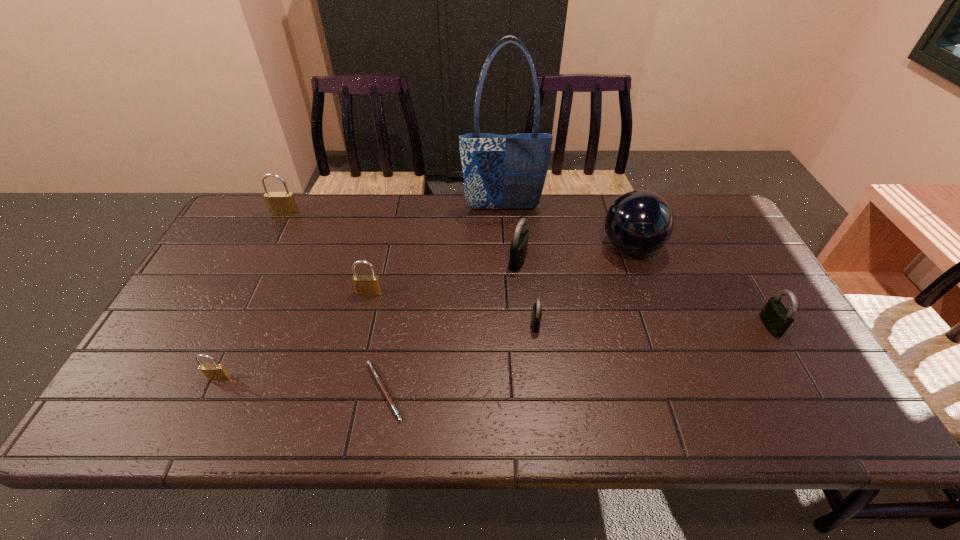
This screenshot has height=540, width=960. What are the coordinates of `the second biggest brass padlock` in the screenshot? It's located at [x=364, y=284].

Where is `the smallest black padlock`? the smallest black padlock is located at coordinates (536, 312).

I want to click on the nearest padlock, so click(212, 371).

At what (x,y) coordinates should I click in order to perform the action: click on the nearest brass padlock. Please return your answer as a coordinate pair (x, y). The height and width of the screenshot is (540, 960). Looking at the image, I should click on (212, 371).

Identify the location of pen. This screenshot has width=960, height=540. (372, 368).

Locate an element on the screen. The image size is (960, 540). pink pen is located at coordinates (372, 368).

Image resolution: width=960 pixels, height=540 pixels. Find the location of `vacant space located 0.220m on the front-facing side of the shopping bag`. vacant space located 0.220m on the front-facing side of the shopping bag is located at coordinates (506, 260).

Image resolution: width=960 pixels, height=540 pixels. In order to click on vacant space located 0.340m on the side of the black bowling ball with the finger holes in this screenshot , I will do `click(488, 247)`.

Find the location of a particular element. Image resolution: width=960 pixels, height=540 pixels. free region located on the side of the black bowling ball with the finger holes is located at coordinates (524, 247).

Where is `blank space located on the side of the black bowling ball with the finger holes`? Image resolution: width=960 pixels, height=540 pixels. blank space located on the side of the black bowling ball with the finger holes is located at coordinates (517, 247).